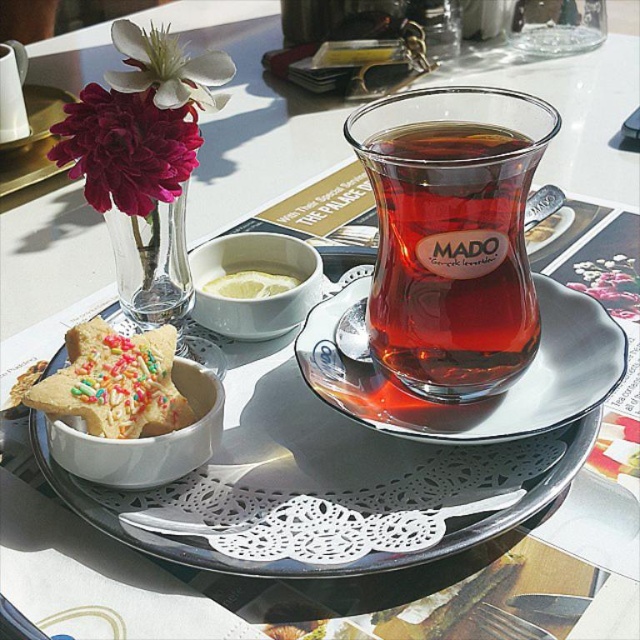
How distant is matte glass vase at upper left from white matte flower at upper left?

matte glass vase at upper left and white matte flower at upper left are 0.82 inches apart from each other.

Does matte glass vase at upper left have a greater height compared to white matte flower at upper left?

Incorrect, matte glass vase at upper left's height is not larger of white matte flower at upper left's.

This screenshot has height=640, width=640. Describe the element at coordinates (125, 148) in the screenshot. I see `matte glass vase at upper left` at that location.

Locate an element on the screen. matte glass vase at upper left is located at coordinates (125, 148).

Between transparent glass tea at center and matte glass vase at upper left, which one has more height?

transparent glass tea at center is taller.

Find the location of `transparent glass tea at center`. transparent glass tea at center is located at coordinates (451, 259).

The width and height of the screenshot is (640, 640). Identify the location of transparent glass tea at center. (451, 259).

Who is positioned more to the left, matte glass vase at upper left or clear glass vase at upper left?

From the viewer's perspective, matte glass vase at upper left appears more on the left side.

This screenshot has height=640, width=640. I want to click on matte glass vase at upper left, so click(x=125, y=148).

Locate an element on the screen. The height and width of the screenshot is (640, 640). matte glass vase at upper left is located at coordinates (125, 148).